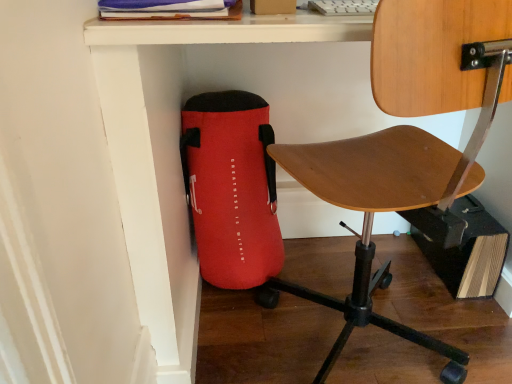
This screenshot has height=384, width=512. In order to click on unoccupied space behind wooden seat at center in this screenshot , I will do `click(354, 258)`.